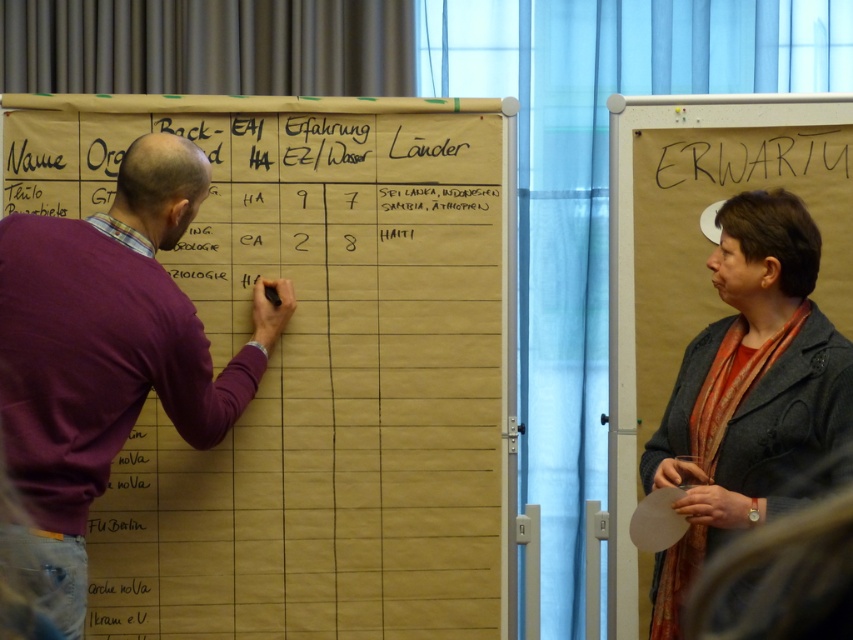
Question: Which point appears farthest from the camera in this image?

Choices:
 (A) (706, 534)
 (B) (44, 240)

Answer: (A)

Question: From the image, what is the correct spatial relationship of purple sweater at left in relation to gray woolen jacket at right?

Choices:
 (A) above
 (B) below

Answer: (A)

Question: Observing the image, what is the correct spatial positioning of purple sweater at left in reference to gray woolen jacket at right?

Choices:
 (A) below
 (B) above

Answer: (B)

Question: Which point appears closest to the camera in this image?

Choices:
 (A) 146,317
 (B) 735,300

Answer: (A)

Question: Does purple sweater at left appear on the right side of gray woolen jacket at right?

Choices:
 (A) yes
 (B) no

Answer: (B)

Question: Which of the following is the closest to the observer?

Choices:
 (A) (151, 237)
 (B) (700, 355)

Answer: (A)